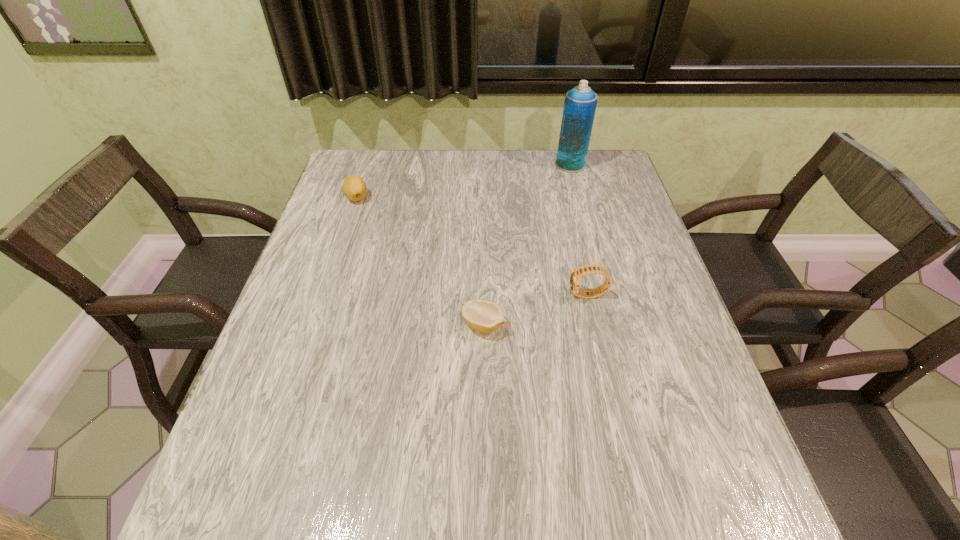
Locate an element on the screen. The image size is (960, 540). object located in the far right corner section of the desktop is located at coordinates (580, 102).

This screenshot has width=960, height=540. In the image, there is a desktop. What are the coordinates of `vacant space at the far edge` in the screenshot? It's located at (508, 174).

Identify the location of vacant space at the left edge of the desktop. (365, 203).

Find the location of a particular element. The height and width of the screenshot is (540, 960). blank space at the right edge of the desktop is located at coordinates (603, 194).

Identify the location of vacant region at the near left corner of the desktop. (253, 516).

The image size is (960, 540). Find the location of `free spot at the near right corner of the desktop`. free spot at the near right corner of the desktop is located at coordinates (738, 504).

Image resolution: width=960 pixels, height=540 pixels. Identify the location of free space between the aerosol can and the shortest object. (527, 245).

Identify the location of empty location between the nearest object and the third farthest object. The image size is (960, 540). (536, 310).

You are a GUI agent. You are given a task and a screenshot of the screen. Output one action in this format:
    pyautogui.click(x=<x>, y=<y>)
    Task: Click on the free spot between the shortest object and the farther lemon
    
    Given the screenshot: What is the action you would take?
    pyautogui.click(x=420, y=261)

Image resolution: width=960 pixels, height=540 pixels. I want to click on vacant point located between the taller lemon and the second tallest object, so click(x=472, y=246).